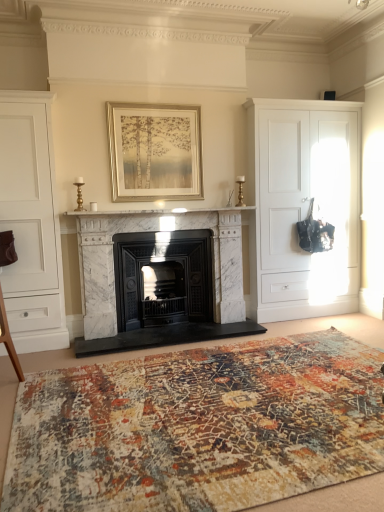
Question: Does white marble fireplace at center have a smaller size compared to white matte cabinet at left, which is counted as the 1th cabinetry, starting from the left?

Choices:
 (A) yes
 (B) no

Answer: (A)

Question: Would you say white marble fireplace at center is outside white matte cabinet at left, the 2th cabinetry when ordered from back to front?

Choices:
 (A) no
 (B) yes

Answer: (B)

Question: Can you confirm if white marble fireplace at center is thinner than white matte cabinet at left, arranged as the second cabinetry when viewed from the right?

Choices:
 (A) no
 (B) yes

Answer: (B)

Question: Could you tell me if white marble fireplace at center is turned towards white matte cabinet at left, arranged as the second cabinetry when viewed from the right?

Choices:
 (A) yes
 (B) no

Answer: (B)

Question: Is white marble fireplace at center placed right next to white matte cabinet at left, arranged as the second cabinetry when viewed from the right?

Choices:
 (A) no
 (B) yes

Answer: (A)

Question: Relative to gold metallic picture frame at upper center, is white marble fireplace at center in front or behind?

Choices:
 (A) front
 (B) behind

Answer: (A)

Question: Which is correct: white marble fireplace at center is inside gold metallic picture frame at upper center, or outside of it?

Choices:
 (A) outside
 (B) inside

Answer: (A)

Question: Is white marble fireplace at center bigger or smaller than gold metallic picture frame at upper center?

Choices:
 (A) small
 (B) big

Answer: (B)

Question: Considering the positions of white marble fireplace at center and gold metallic picture frame at upper center in the image, is white marble fireplace at center taller or shorter than gold metallic picture frame at upper center?

Choices:
 (A) short
 (B) tall

Answer: (B)

Question: Considering the positions of white marble fireplace at center and abstract patterned rug at center in the image, is white marble fireplace at center taller or shorter than abstract patterned rug at center?

Choices:
 (A) tall
 (B) short

Answer: (A)

Question: Would you say white marble fireplace at center is inside or outside abstract patterned rug at center?

Choices:
 (A) inside
 (B) outside

Answer: (B)

Question: In the image, is white marble fireplace at center positioned in front of or behind abstract patterned rug at center?

Choices:
 (A) front
 (B) behind

Answer: (B)

Question: In terms of size, does white marble fireplace at center appear bigger or smaller than abstract patterned rug at center?

Choices:
 (A) big
 (B) small

Answer: (B)

Question: In terms of width, does white matte cabinet at right, the 1th cabinetry viewed from the right, look wider or thinner when compared to white matte cabinet at left, which is counted as the 1th cabinetry, starting from the left?

Choices:
 (A) wide
 (B) thin

Answer: (A)

Question: Would you say white matte cabinet at right, which is counted as the 2th cabinetry, starting from the front, is inside or outside white matte cabinet at left, arranged as the second cabinetry when viewed from the right?

Choices:
 (A) inside
 (B) outside

Answer: (B)